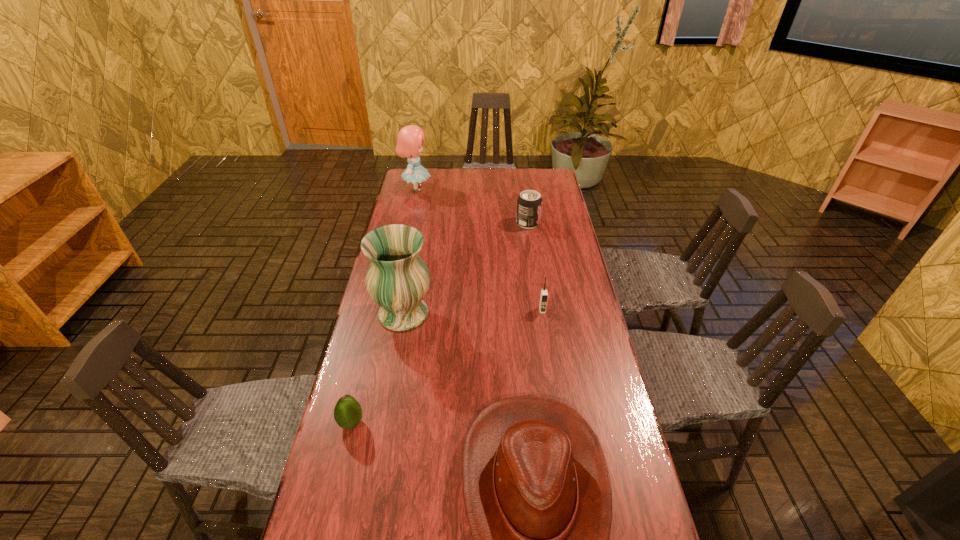
You are a GUI agent. You are given a task and a screenshot of the screen. Output one action in this format:
    pyautogui.click(x=<x>, y=<y>)
    Task: Click on the object positioned at the far edge
    
    Given the screenshot: What is the action you would take?
    pyautogui.click(x=409, y=142)

Locate an element on the screen. Image resolution: width=960 pixels, height=540 pixels. doll present at the left edge is located at coordinates (409, 142).

At what (x,y) coordinates should I click in order to perform the action: click on vase at the left edge. Please return your answer as a coordinate pair (x, y). Looking at the image, I should click on (397, 279).

Image resolution: width=960 pixels, height=540 pixels. Find the location of `avocado positioned at the left edge`. avocado positioned at the left edge is located at coordinates (347, 413).

Locate an element on the screen. cellular telephone that is positioned at the right edge is located at coordinates (544, 294).

Locate an element on the screen. soda can that is at the right edge is located at coordinates (529, 204).

I want to click on object located in the far left corner section of the desktop, so click(x=409, y=142).

In order to click on vacant space at the far edge of the desktop in this screenshot , I will do `click(487, 192)`.

You are a GUI agent. You are given a task and a screenshot of the screen. Output one action in this format:
    pyautogui.click(x=<x>, y=<y>)
    Task: Click on the vacant space at the left edge of the desktop
    
    Given the screenshot: What is the action you would take?
    pyautogui.click(x=423, y=251)

The image size is (960, 540). What are the coordinates of `free region at the right edge of the desktop` in the screenshot? It's located at (569, 374).